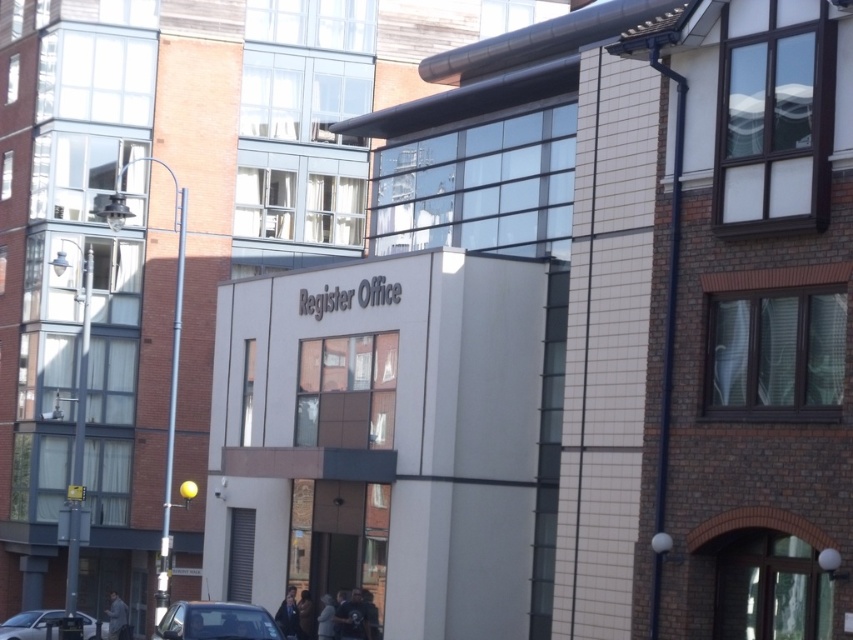
Question: Among these points, which one is nearest to the camera?

Choices:
 (A) (157, 627)
 (B) (93, 618)

Answer: (A)

Question: Which point is farther to the camera?

Choices:
 (A) silver metallic car at lower left
 (B) metallic silver car at lower center

Answer: (A)

Question: Is metallic silver car at lower center in front of silver metallic car at lower left?

Choices:
 (A) no
 (B) yes

Answer: (B)

Question: Can you confirm if metallic silver car at lower center is bigger than silver metallic car at lower left?

Choices:
 (A) no
 (B) yes

Answer: (A)

Question: Which point is closer to the camera?

Choices:
 (A) (228, 627)
 (B) (107, 621)

Answer: (A)

Question: Can you confirm if metallic silver car at lower center is thinner than silver metallic car at lower left?

Choices:
 (A) yes
 (B) no

Answer: (A)